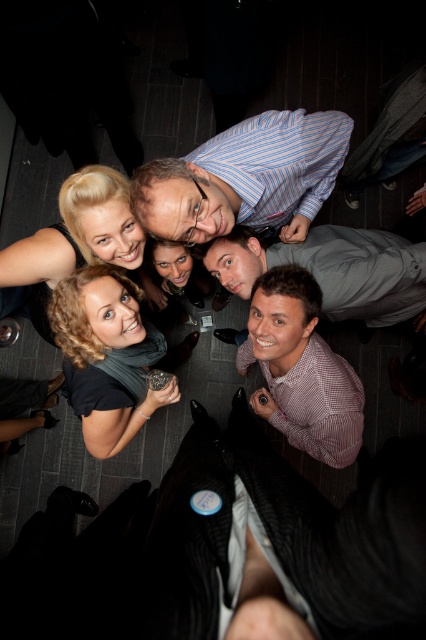
Consider the image. You are at a party and want to take a photo with the checkered fabric shirt at lower right and the gray fabric shirt at center. Which shirt should you focus on to ensure it fits in the frame since it takes up more space?

The checkered fabric shirt at lower right is bigger than the gray fabric shirt at center, so you should focus on the checkered fabric shirt at lower right to ensure it fits in the frame since it takes up more space.

You are standing in the center of the room and want to hand a drink to the person wearing the checkered fabric shirt at lower right. In which direction should you move to reach them?

The checkered fabric shirt at lower right is located at point (301, 369), so you should move towards the lower right direction to reach them.

You are at a party and see a group of people. You notice a point at coordinates (301, 369). Which object in the scene does this point belong to?

The point at coordinates (301, 369) is on the checkered fabric shirt at lower right.